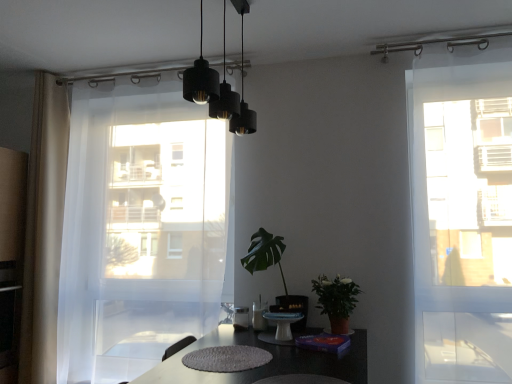
Locate an element on the screen. This screenshot has height=384, width=512. green leafy plant at center, which appears as the first houseplant when viewed from the left is located at coordinates (280, 273).

Describe the element at coordinates (44, 229) in the screenshot. I see `white sheer curtain at left, which is counted as the first curtain, starting from the left` at that location.

Locate an element on the screen. This screenshot has height=384, width=512. green leafy plant at center, which is the second houseplant from right to left is located at coordinates (280, 273).

Is white sheer curtain at left, positioned as the first curtain in right-to-left order, bigger than black matte pendant lights at upper center?

Indeed, white sheer curtain at left, positioned as the first curtain in right-to-left order, has a larger size compared to black matte pendant lights at upper center.

Is white sheer curtain at left, placed as the second curtain when sorted from left to right, in contact with black matte pendant lights at upper center?

No, white sheer curtain at left, placed as the second curtain when sorted from left to right, is not touching black matte pendant lights at upper center.

From the image's perspective, starting from the black matte pendant lights at upper center, which curtain is the 2nd one below? Please provide its 2D coordinates.

[(139, 228)]

Does white sheer curtain at left, positioned as the first curtain in right-to-left order, contain black matte pendant lights at upper center?

No, black matte pendant lights at upper center is located outside of white sheer curtain at left, positioned as the first curtain in right-to-left order.

Which of these two, transparent glass door at right or white sheer curtain at left, which is counted as the first curtain, starting from the left, stands taller?

white sheer curtain at left, which is counted as the first curtain, starting from the left.

Considering the positions of objects transparent glass door at right and white sheer curtain at left, which is counted as the first curtain, starting from the left, in the image provided, who is behind, transparent glass door at right or white sheer curtain at left, which is counted as the first curtain, starting from the left,?

white sheer curtain at left, which is counted as the first curtain, starting from the left, is behind.

This screenshot has width=512, height=384. In the image, there is a white sheer curtain at left, marked as the second curtain in a right-to-left arrangement. Identify the location of door above it (from the image's perspective). (462, 214).

Is white sheer curtain at left, marked as the second curtain in a right-to-left arrangement, at the back of transparent glass door at right?

That's not correct — transparent glass door at right is not looking away from white sheer curtain at left, marked as the second curtain in a right-to-left arrangement.

Is white sheer curtain at left, marked as the second curtain in a right-to-left arrangement, to the left or to the right of green matte plant at center-right, the 1th houseplant viewed from the right, in the image?

Clearly, white sheer curtain at left, marked as the second curtain in a right-to-left arrangement, is on the left of green matte plant at center-right, the 1th houseplant viewed from the right, in the image.

From a real-world perspective, who is located lower, white sheer curtain at left, marked as the second curtain in a right-to-left arrangement, or green matte plant at center-right, marked as the second houseplant in a left-to-right arrangement?

In real-world perspective, green matte plant at center-right, marked as the second houseplant in a left-to-right arrangement, is lower.

In terms of height, does white sheer curtain at left, marked as the second curtain in a right-to-left arrangement, look taller or shorter compared to green matte plant at center-right, the 1th houseplant viewed from the right?

In the image, white sheer curtain at left, marked as the second curtain in a right-to-left arrangement, appears to be taller than green matte plant at center-right, the 1th houseplant viewed from the right.

Is point (426, 128) farther from camera compared to point (198, 215)?

No.

Is transparent glass door at right next to white sheer curtain at left, positioned as the first curtain in right-to-left order, and touching it?

No, transparent glass door at right is not with white sheer curtain at left, positioned as the first curtain in right-to-left order.

Would you say transparent glass door at right is outside white sheer curtain at left, placed as the second curtain when sorted from left to right?

Yes, transparent glass door at right is not within white sheer curtain at left, placed as the second curtain when sorted from left to right.

The width and height of the screenshot is (512, 384). Identify the location of lighting above the green leafy plant at center, which appears as the first houseplant when viewed from the left (from a real-world perspective). (219, 87).

Between black matte pendant lights at upper center and green leafy plant at center, which is the second houseplant from right to left, which one has larger size?

black matte pendant lights at upper center is bigger.

Considering the relative positions of black matte pendant lights at upper center and green leafy plant at center, which is the second houseplant from right to left, in the image provided, is black matte pendant lights at upper center to the right of green leafy plant at center, which is the second houseplant from right to left, from the viewer's perspective?

No, black matte pendant lights at upper center is not to the right of green leafy plant at center, which is the second houseplant from right to left.

Which is nearer, (201, 28) or (254, 239)?

Positioned in front is point (201, 28).

What's the angular difference between black matte pendant lights at upper center and green matte plant at center-right, the 1th houseplant viewed from the right,'s facing directions?

0.000127 degrees.

From a real-world perspective, who is located lower, black matte pendant lights at upper center or green matte plant at center-right, marked as the second houseplant in a left-to-right arrangement?

green matte plant at center-right, marked as the second houseplant in a left-to-right arrangement.

Does black matte pendant lights at upper center have a smaller size compared to green matte plant at center-right, the 1th houseplant viewed from the right?

No.

Between black matte pendant lights at upper center and green matte plant at center-right, the 1th houseplant viewed from the right, which one is positioned in front?

black matte pendant lights at upper center is closer to the camera.

From the image's perspective, which curtain is the 1st one above the green matte plant at center-right, marked as the second houseplant in a left-to-right arrangement? Please provide its 2D coordinates.

[(139, 228)]

Relative to green matte plant at center-right, marked as the second houseplant in a left-to-right arrangement, is white sheer curtain at left, placed as the second curtain when sorted from left to right, in front or behind?

white sheer curtain at left, placed as the second curtain when sorted from left to right, is behind green matte plant at center-right, marked as the second houseplant in a left-to-right arrangement.

From a real-world perspective, does white sheer curtain at left, positioned as the first curtain in right-to-left order, stand above green matte plant at center-right, marked as the second houseplant in a left-to-right arrangement?

Yes, from a real-world perspective, white sheer curtain at left, positioned as the first curtain in right-to-left order, is above green matte plant at center-right, marked as the second houseplant in a left-to-right arrangement.

Is white sheer curtain at left, placed as the second curtain when sorted from left to right, positioned far away from green matte plant at center-right, marked as the second houseplant in a left-to-right arrangement?

Yes, white sheer curtain at left, placed as the second curtain when sorted from left to right, and green matte plant at center-right, marked as the second houseplant in a left-to-right arrangement, are located far from each other.

The image size is (512, 384). I want to click on lighting in front of the white sheer curtain at left, positioned as the first curtain in right-to-left order, so click(219, 87).

This screenshot has height=384, width=512. Find the location of `door that is above the white sheer curtain at left, which is counted as the first curtain, starting from the left (from a real-world perspective)`. door that is above the white sheer curtain at left, which is counted as the first curtain, starting from the left (from a real-world perspective) is located at coordinates (462, 214).

Considering their positions, is white sheer curtain at left, which is counted as the first curtain, starting from the left, positioned further to green leafy plant at center, which is the second houseplant from right to left, than white sheer curtain at left, placed as the second curtain when sorted from left to right?

Among the two, white sheer curtain at left, which is counted as the first curtain, starting from the left, is located further to green leafy plant at center, which is the second houseplant from right to left.

Looking at this image, looking at the image, which one is located further to green leafy plant at center, which is the second houseplant from right to left, green matte plant at center-right, the 1th houseplant viewed from the right, or black matte pendant lights at upper center?

black matte pendant lights at upper center is positioned further to the anchor green leafy plant at center, which is the second houseplant from right to left.

Considering their positions, is white sheer curtain at left, marked as the second curtain in a right-to-left arrangement, positioned closer to white sheer curtain at left, positioned as the first curtain in right-to-left order, than green matte plant at center-right, marked as the second houseplant in a left-to-right arrangement?

Based on the image, white sheer curtain at left, marked as the second curtain in a right-to-left arrangement, appears to be nearer to white sheer curtain at left, positioned as the first curtain in right-to-left order.

When comparing their distances from black matte pendant lights at upper center, does white sheer curtain at left, placed as the second curtain when sorted from left to right, or white sheer curtain at left, which is counted as the first curtain, starting from the left, seem further?

white sheer curtain at left, which is counted as the first curtain, starting from the left, is positioned further to the anchor black matte pendant lights at upper center.

From the picture: Estimate the real-world distances between objects in this image. Which object is further from green leafy plant at center, which is the second houseplant from right to left, black matte pendant lights at upper center or transparent glass door at right?

black matte pendant lights at upper center is positioned further to the anchor green leafy plant at center, which is the second houseplant from right to left.

Based on their spatial positions, is black matte pendant lights at upper center or white sheer curtain at left, positioned as the first curtain in right-to-left order, further from green matte plant at center-right, marked as the second houseplant in a left-to-right arrangement?

white sheer curtain at left, positioned as the first curtain in right-to-left order, is further to green matte plant at center-right, marked as the second houseplant in a left-to-right arrangement.

Which object lies further to the anchor point green matte plant at center-right, the 1th houseplant viewed from the right, green leafy plant at center, which appears as the first houseplant when viewed from the left, or transparent glass door at right?

Among the two, transparent glass door at right is located further to green matte plant at center-right, the 1th houseplant viewed from the right.

Which object lies further to the anchor point transparent glass door at right, black matte pendant lights at upper center or white sheer curtain at left, which is counted as the first curtain, starting from the left?

Based on the image, white sheer curtain at left, which is counted as the first curtain, starting from the left, appears to be further to transparent glass door at right.

At what (x,y) coordinates should I click in order to perform the action: click on houseplant between green leafy plant at center, which appears as the first houseplant when viewed from the left, and transparent glass door at right, in the horizontal direction. Please return your answer as a coordinate pair (x, y). Looking at the image, I should click on (336, 300).

Where is `curtain between white sheer curtain at left, which is counted as the first curtain, starting from the left, and black matte pendant lights at upper center`? The width and height of the screenshot is (512, 384). curtain between white sheer curtain at left, which is counted as the first curtain, starting from the left, and black matte pendant lights at upper center is located at coordinates (139, 228).

Image resolution: width=512 pixels, height=384 pixels. I want to click on curtain between white sheer curtain at left, which is counted as the first curtain, starting from the left, and green leafy plant at center, which is the second houseplant from right to left, from left to right, so (139, 228).

Where is `lighting situated between white sheer curtain at left, positioned as the first curtain in right-to-left order, and transparent glass door at right from left to right`? The height and width of the screenshot is (384, 512). lighting situated between white sheer curtain at left, positioned as the first curtain in right-to-left order, and transparent glass door at right from left to right is located at coordinates (219, 87).